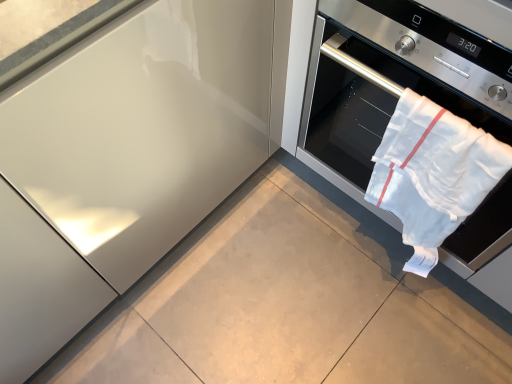
Question: Looking at the image, does white cotton towel at right seem bigger or smaller compared to white cloth oven at right?

Choices:
 (A) small
 (B) big

Answer: (A)

Question: Is white cotton towel at right in front of or behind white cloth oven at right in the image?

Choices:
 (A) front
 (B) behind

Answer: (B)

Question: From the image's perspective, is white cotton towel at right above or below white cloth oven at right?

Choices:
 (A) above
 (B) below

Answer: (B)

Question: Looking at the image, does white cloth oven at right seem bigger or smaller compared to white cotton towel at right?

Choices:
 (A) small
 (B) big

Answer: (B)

Question: Considering their positions, is white cloth oven at right located in front of or behind white cotton towel at right?

Choices:
 (A) behind
 (B) front

Answer: (B)

Question: From a real-world perspective, is white cloth oven at right positioned above or below white cotton towel at right?

Choices:
 (A) above
 (B) below

Answer: (A)

Question: Looking at their shapes, would you say white cloth oven at right is wider or thinner than white cotton towel at right?

Choices:
 (A) thin
 (B) wide

Answer: (B)